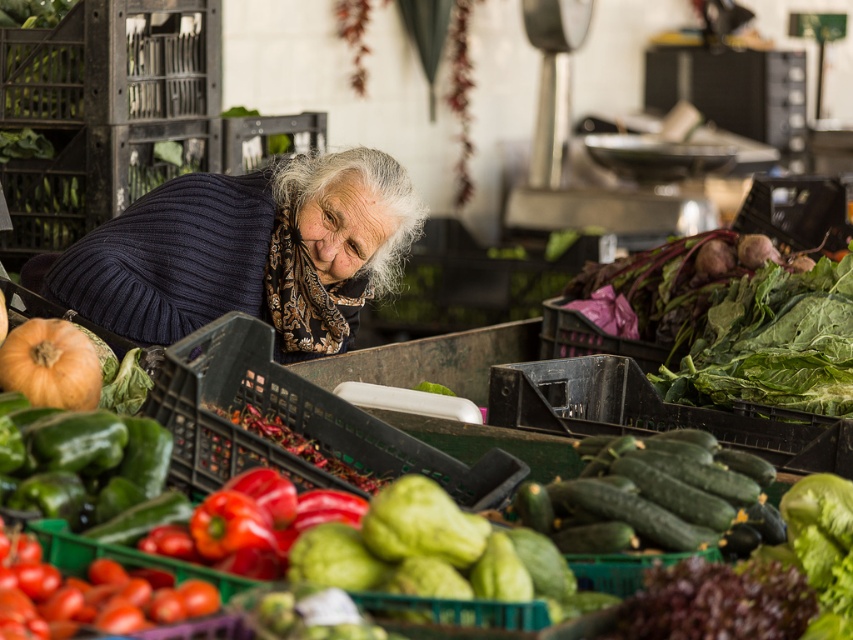
You are a customer at the market stall and want to buy both the green leafy at center and the orange matte pumpkin at lower left. Which one is located to the right of the other?

The green leafy at center is positioned on the right side of orange matte pumpkin at lower left.

You are a customer at the market stall and want to pick up the orange matte pumpkin at lower left. However, the knitted dark blue sweater at center is in your way. Can you reach the pumpkin without moving the sweater?

The orange matte pumpkin at lower left is behind the knitted dark blue sweater at center, so you can reach it without moving the sweater by going around the front of the sweater.

You are holding a camera and want to take a photo of the knitted dark blue sweater at center. If you are currently standing 3.81 meters away from it, is the distance sufficient for a clear, detailed photo?

The knitted dark blue sweater at center and camera are 3.81 meters apart from each other. The distance of 3.81 meters is sufficient for a clear, detailed photo as long as the camera has a zoom lens or the sweater is large enough to be captured clearly at that distance.